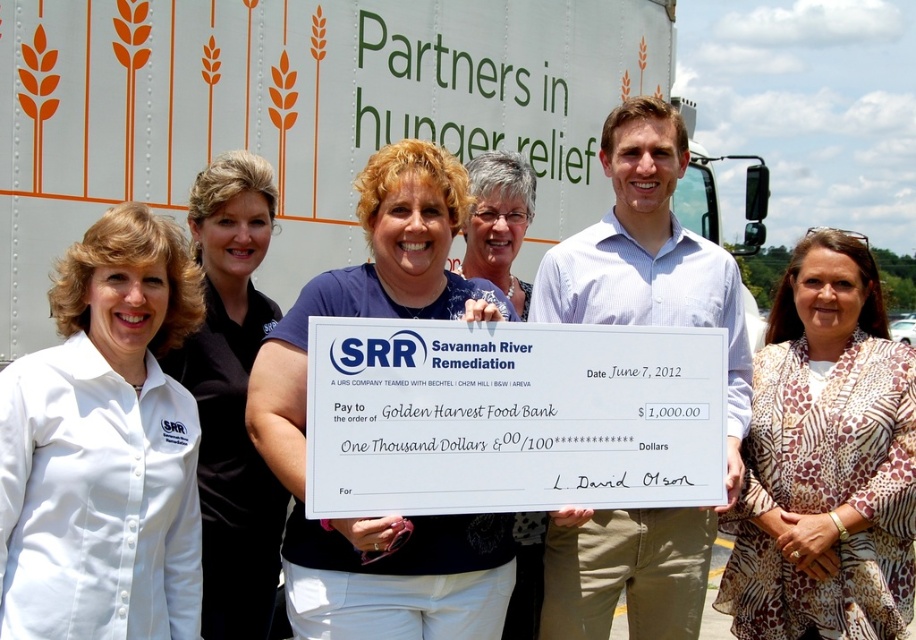
You are a photographer at the event and need to arrange the participants for a group photo. The director wants the person in the white shirt at center to be positioned to the right of the printed fabric blouse at center. Can you adjust their positions without moving anyone else?

The white shirt at center is currently to the left of the printed fabric blouse at center. To comply with the director, you would need to move the white shirt at center to the right of the printed fabric blouse at center. However, since the director specified not to move anyone else, this adjustment isn

Consider the image. You are a photographer at the event and need to ensure both the white matte trailer truck at upper center and the printed fabric blouse at center are visible in your photo. Based on their positions, which object should you focus on first to capture both in the frame?

The white matte trailer truck at upper center is above the printed fabric blouse at center, so you should focus on the white matte trailer truck at upper center first to ensure both are in the frame.